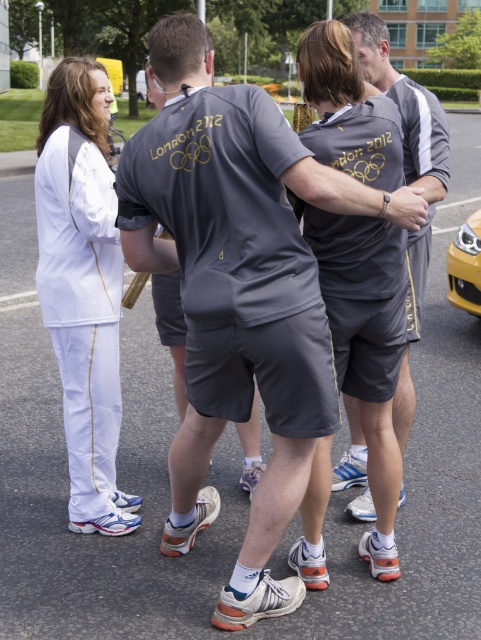
Between point (392, 404) and point (476, 212), which one is positioned behind?

The point (476, 212) is more distant.

Can you confirm if gray athletic shorts at center is positioned above yellow matte car at right?

Yes, gray athletic shorts at center is above yellow matte car at right.

Where is `gray athletic shorts at center`? The width and height of the screenshot is (481, 640). gray athletic shorts at center is located at coordinates (407, 179).

Does white smooth uniform at left appear on the right side of yellow matte car at right?

Incorrect, white smooth uniform at left is not on the right side of yellow matte car at right.

Looking at this image, does white smooth uniform at left have a lesser width compared to yellow matte car at right?

No, white smooth uniform at left is not thinner than yellow matte car at right.

Find the location of `white smooth uniform at left`. white smooth uniform at left is located at coordinates (83, 289).

Image resolution: width=481 pixels, height=640 pixels. Find the location of `white smooth uniform at left`. white smooth uniform at left is located at coordinates (83, 289).

Is point (206, 236) positioned in front of point (418, 147)?

Yes, point (206, 236) is closer to viewer.

Between point (249, 156) and point (414, 173), which one is positioned in front?

Point (249, 156) is in front.

At what (x,y) coordinates should I click in order to perform the action: click on matte gray t-shirt at center. Please return your answer as a coordinate pair (x, y). This screenshot has width=481, height=640. Looking at the image, I should click on (239, 292).

Identify the location of matte gray t-shirt at center. (239, 292).